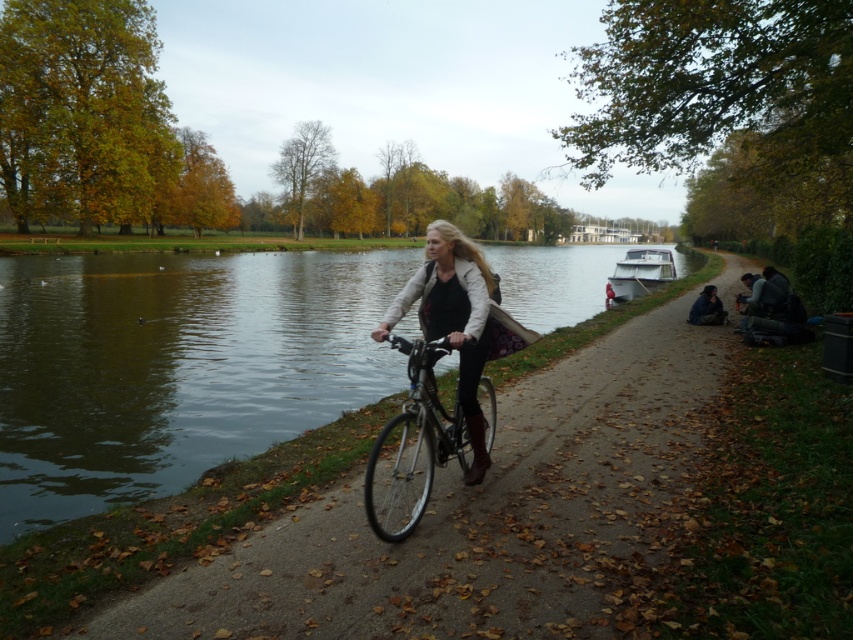
Question: Is shiny black bicycle at center thinner than matte black jacket at center?

Choices:
 (A) yes
 (B) no

Answer: (B)

Question: Estimate the real-world distances between objects in this image. Which object is farther from the white glossy boat at right?

Choices:
 (A) clear water at center
 (B) shiny black bicycle at center
 (C) matte black jacket at center

Answer: (C)

Question: Observing the image, what is the correct spatial positioning of clear water at center in reference to matte black jacket at center?

Choices:
 (A) left
 (B) right

Answer: (A)

Question: Estimate the real-world distances between objects in this image. Which object is farther from the white glossy boat at right?

Choices:
 (A) shiny black bicycle at center
 (B) dark blue jeans at right

Answer: (A)

Question: Which of these objects is positioned closest to the white glossy boat at right?

Choices:
 (A) shiny black bicycle at center
 (B) dark blue jeans at right
 (C) matte black jacket at center
 (D) clear water at center

Answer: (B)

Question: Can you confirm if shiny black bicycle at center is wider than matte black jacket at center?

Choices:
 (A) no
 (B) yes

Answer: (B)